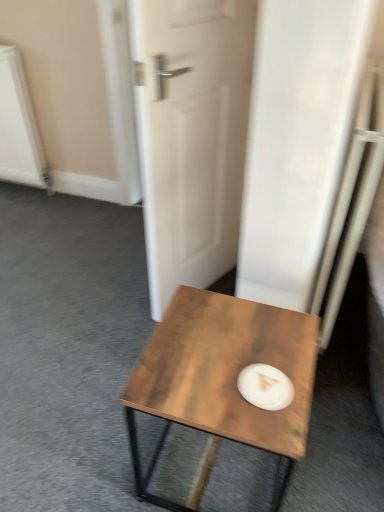
Question: From the image's perspective, is white matte door at center positioned above or below wooden coffee table at center?

Choices:
 (A) below
 (B) above

Answer: (B)

Question: Would you say white matte door at center is to the left or to the right of wooden coffee table at center in the picture?

Choices:
 (A) left
 (B) right

Answer: (A)

Question: Which object is positioned farthest from the white matte paper plate at center?

Choices:
 (A) white matte door at center
 (B) wooden coffee table at center

Answer: (A)

Question: Based on their relative distances, which object is farther from the white matte door at center?

Choices:
 (A) wooden coffee table at center
 (B) white matte paper plate at center

Answer: (B)